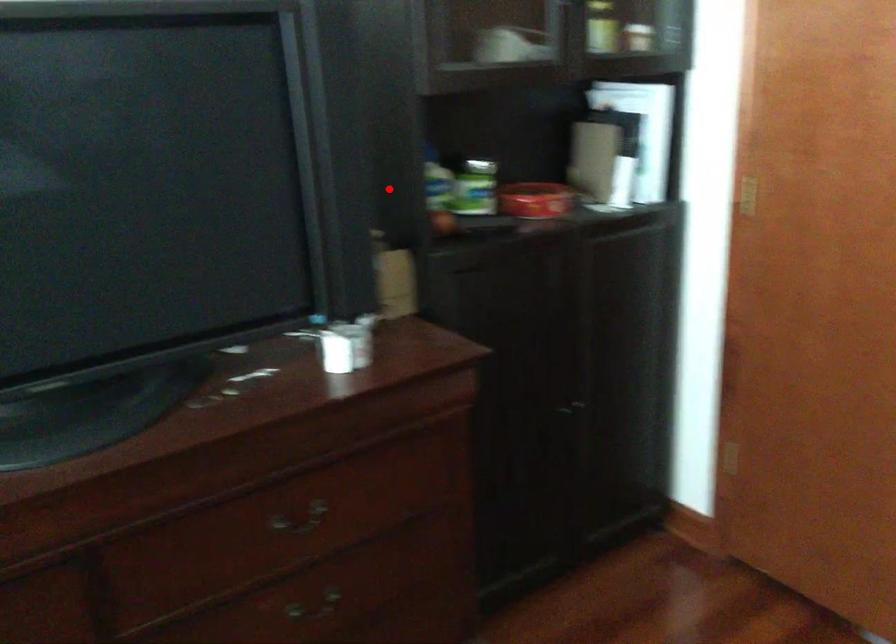
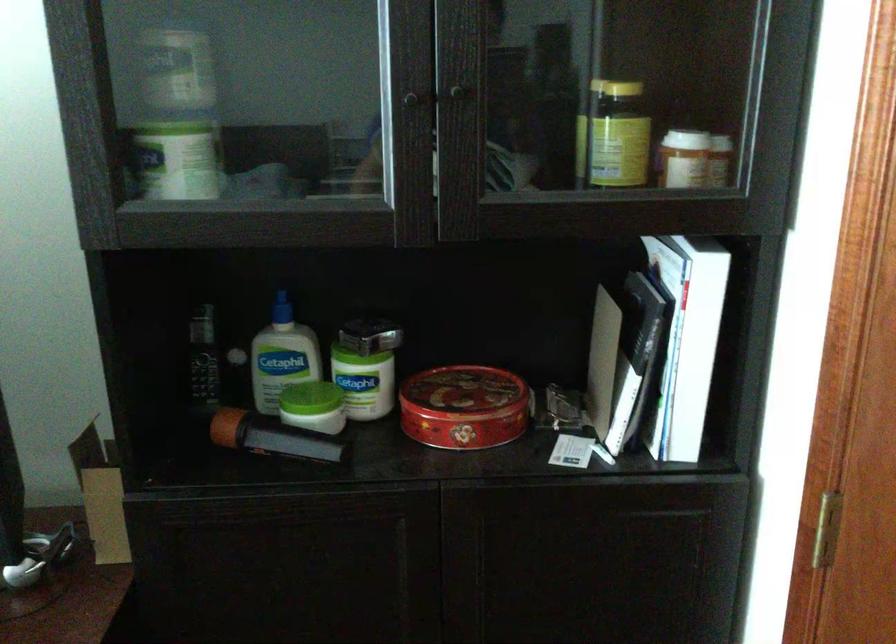
In the second image, find the point that corresponds to the highlighted location in the first image.

(202, 357)